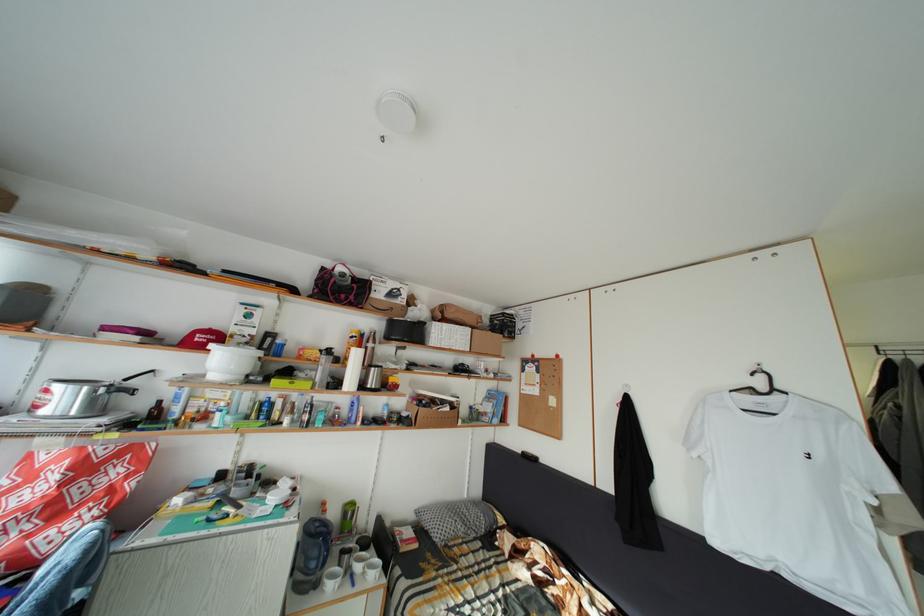
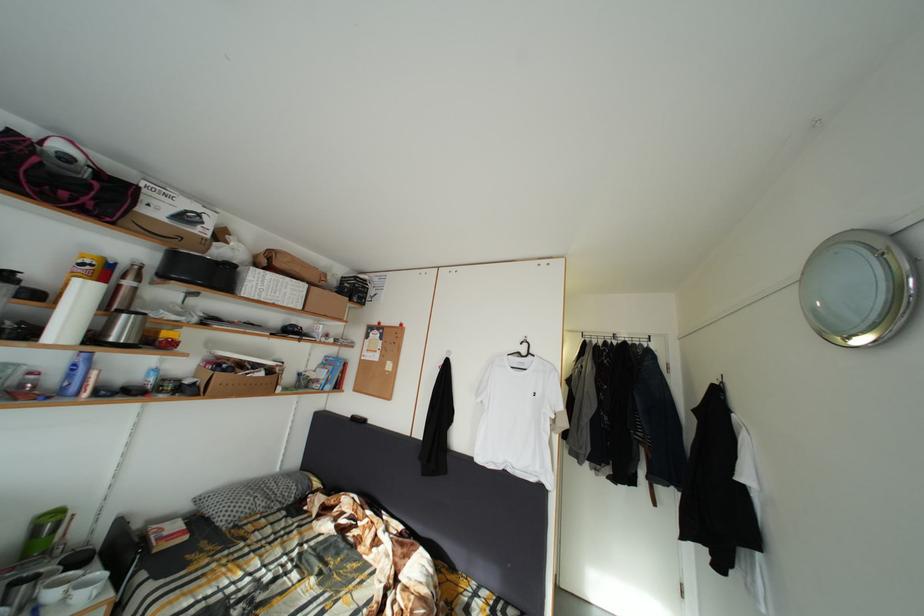
The point at [359,424] is marked in the first image. Where is the corresponding point in the second image?

(73, 395)